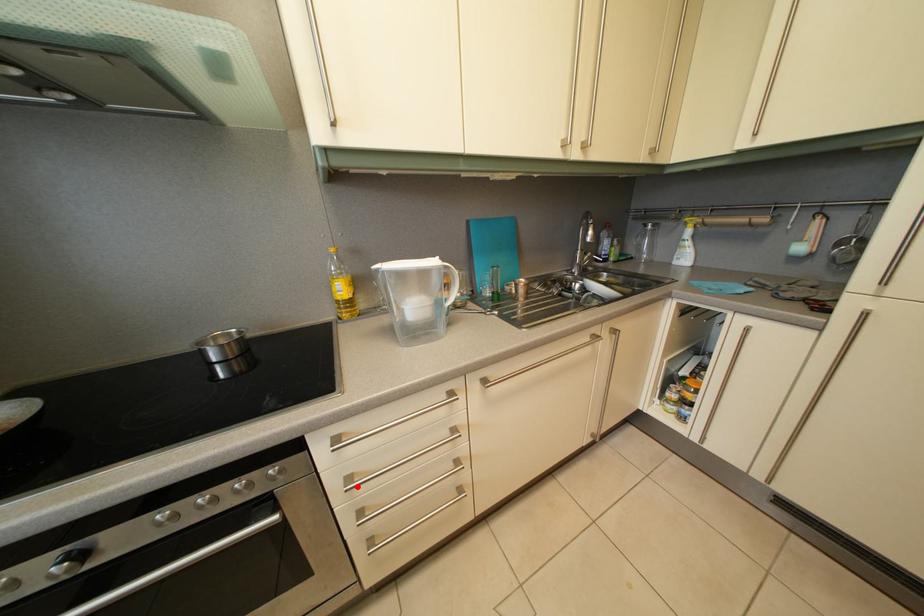
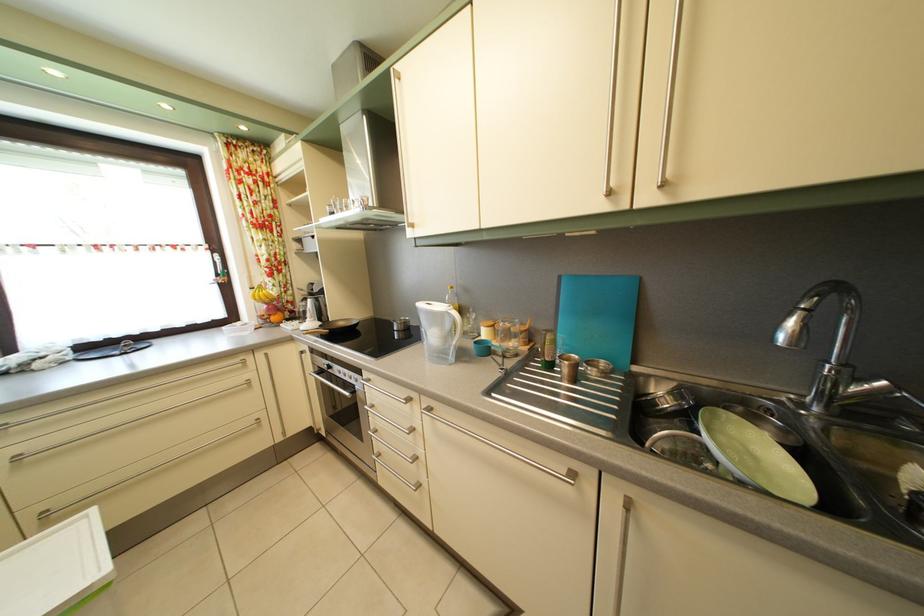
Question: I am providing you with two images of the same scene from different viewpoints. In image1, a red point is highlighted. Considering the same 3D point in image2, which of the following is correct?

Choices:
 (A) It is closer
 (B) It is farther

Answer: (B)